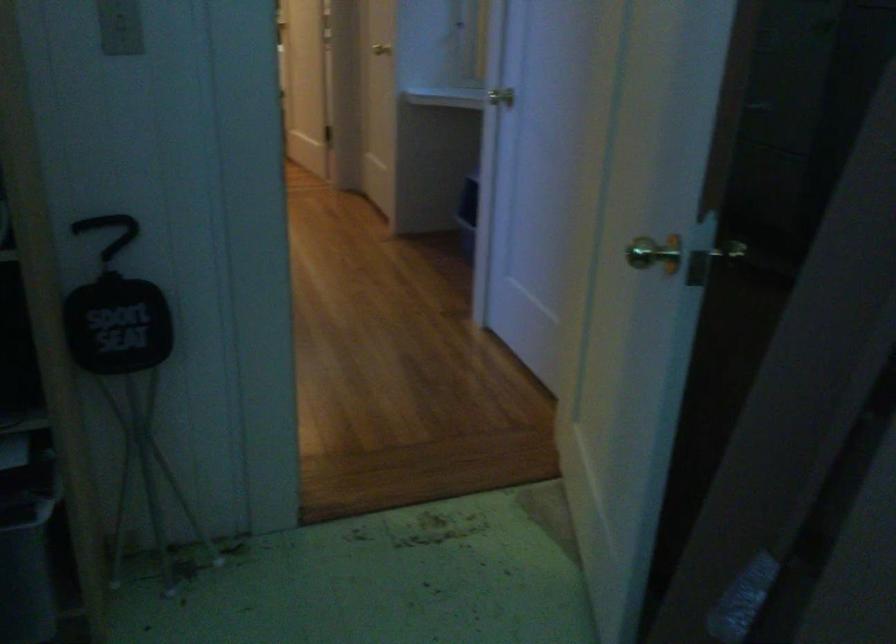
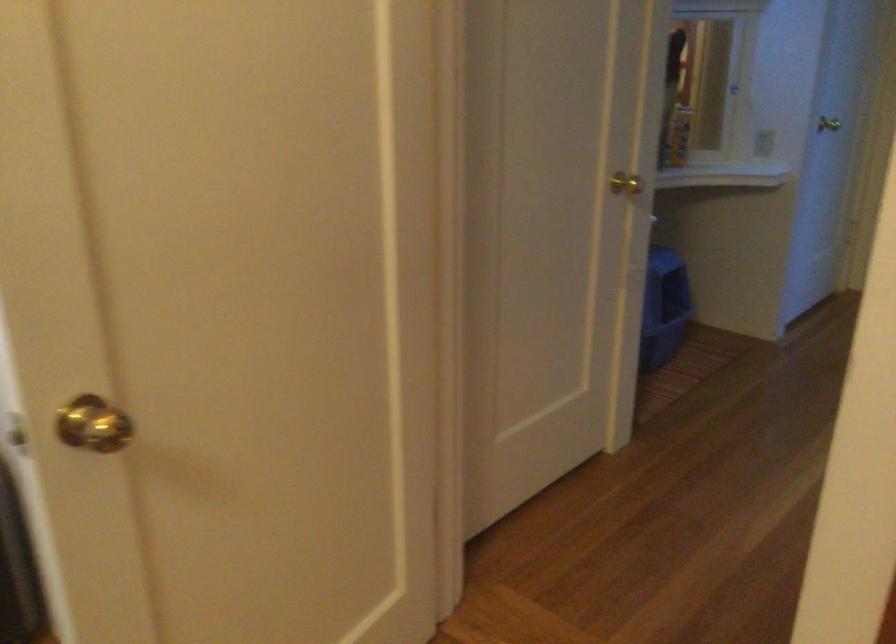
Locate, in the second image, the point that corresponds to point 536,102 in the first image.

(762, 143)